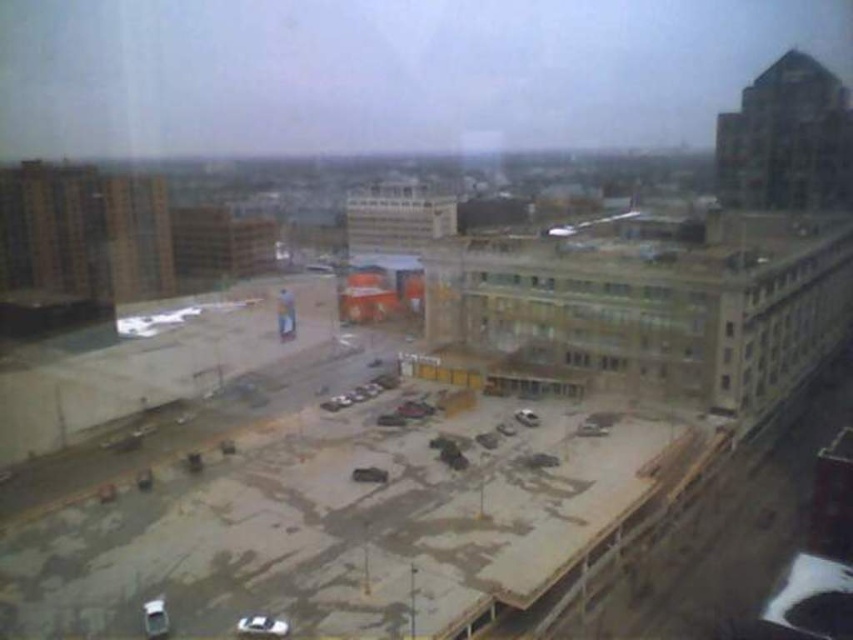
You are a delivery person trying to park your vehicle in the construction area. You see the silver metallic car at lower center and the white matte car at lower left. Which car should you avoid parking next to if you want to maximize the available space?

You should avoid parking next to the silver metallic car at lower center because it is larger in size than the white matte car at lower left, leaving less space for your vehicle.

You are standing on a balcony overlooking the construction site. You need to move a tool from the silver metallic car at lower center to the white matte car at lower left. Which car should you walk towards first?

You should walk towards the silver metallic car at lower center first because it is in front of the white matte car at lower left, making it closer to your current position on the balcony.

You are a delivery person needing to park your vehicle in the construction area shown in the image. You have two options for parking spots between the silver metallic car at lower center and the white matte car at lower left. Which parking spot would allow you to park a wider vehicle?

The parking spot between the silver metallic car at lower center and the white matte car at lower left would accommodate a wider vehicle since the silver metallic car at lower center is wider than the white matte car at lower left according to their positions.